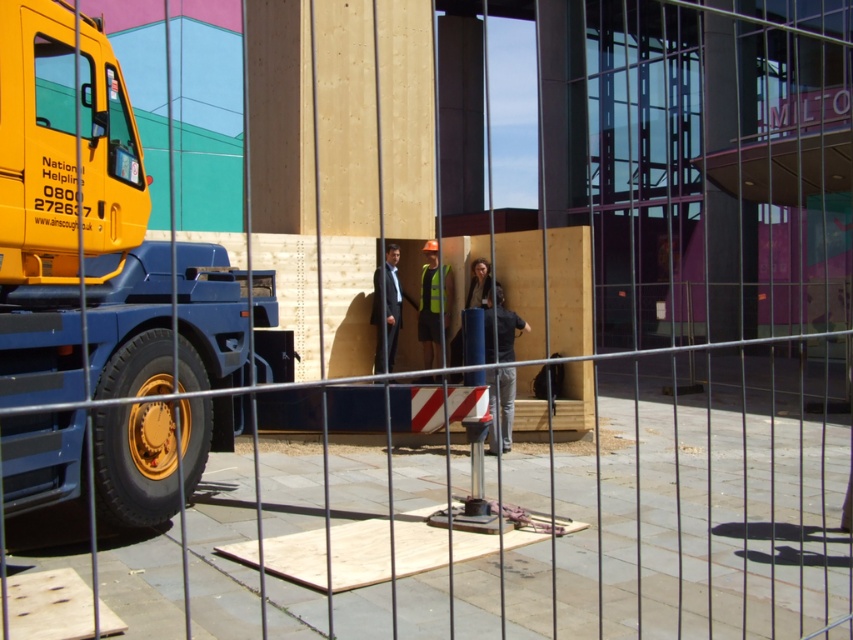
Question: Which of the following is the farthest from the observer?

Choices:
 (A) (120, 252)
 (B) (390, 266)

Answer: (B)

Question: Can you confirm if yellow metallic trailer truck at left is positioned to the left of dark gray suit at center?

Choices:
 (A) yes
 (B) no

Answer: (A)

Question: Does yellow metallic trailer truck at left have a lesser width compared to dark gray suit at center?

Choices:
 (A) no
 (B) yes

Answer: (A)

Question: Does yellow metallic trailer truck at left have a greater width compared to dark gray suit at center?

Choices:
 (A) yes
 (B) no

Answer: (A)

Question: Which of the following is the closest to the observer?

Choices:
 (A) yellow metallic trailer truck at left
 (B) dark gray suit at center

Answer: (A)